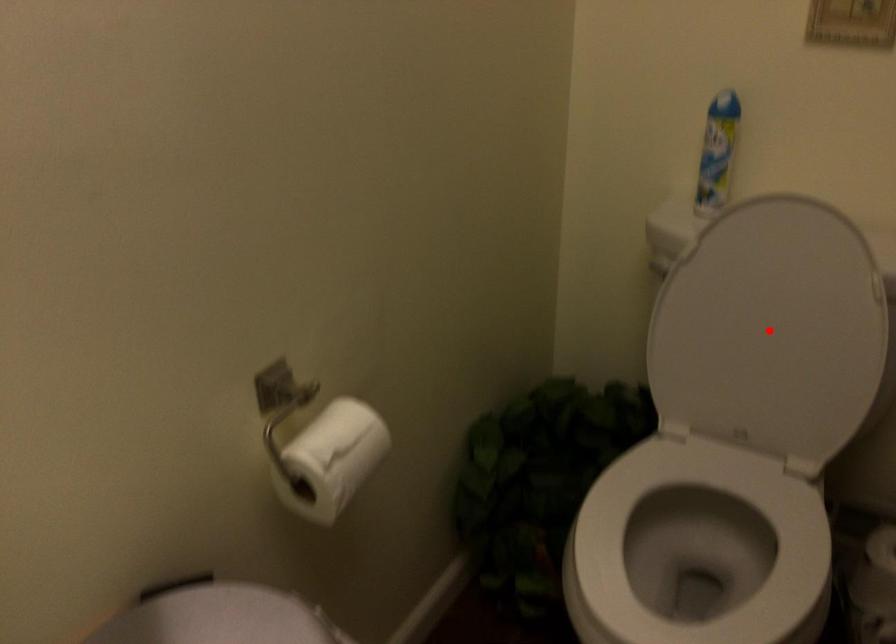
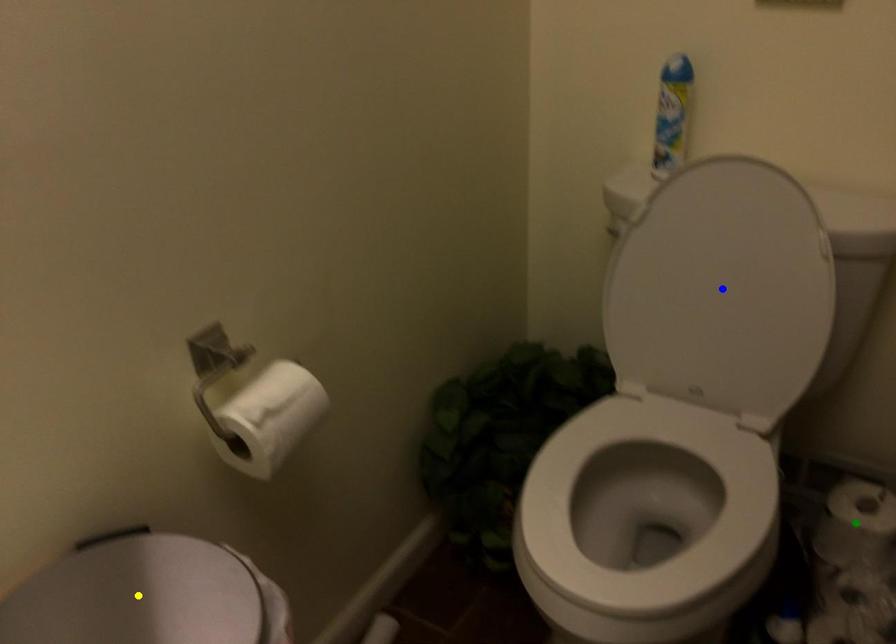
Question: I am providing you with two images of the same scene from different viewpoints. A red point is marked on the first image. You are given multiple points on the second image. Which point in image 2 is actually the same real-world point as the red point in image 1?

Choices:
 (A) blue point
 (B) yellow point
 (C) green point

Answer: (A)